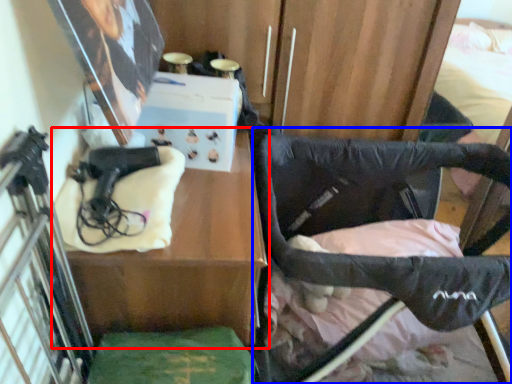
Question: Which object appears farthest to the camera in this image, table (highlighted by a red box) or furniture (highlighted by a blue box)?

Choices:
 (A) table
 (B) furniture

Answer: (B)